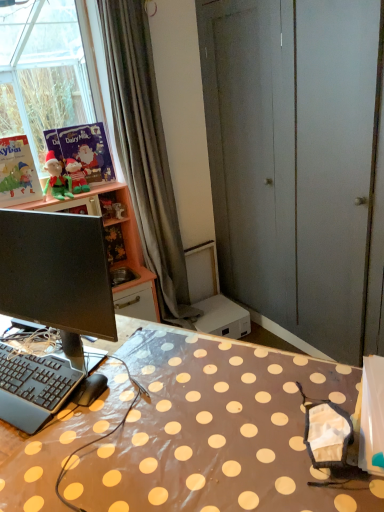
This screenshot has height=512, width=384. I want to click on free location in front of black matte computer monitor at left, so click(x=85, y=447).